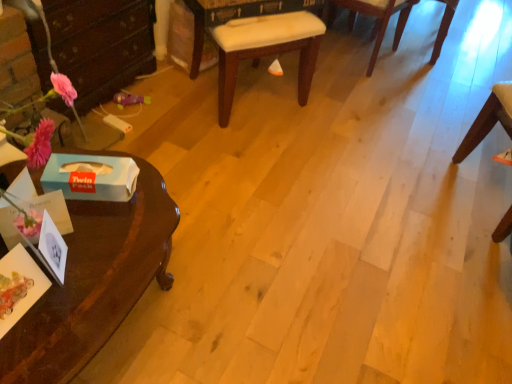
Question: Should I look upward or downward to see wooden chair at upper right, which ranks as the first chair in right-to-left order?

Choices:
 (A) up
 (B) down

Answer: (A)

Question: Is the position of white cardboard box at lower left, the 2th box when ordered from front to back, more distant than that of white fabric cushion at center, positioned as the first chair in left-to-right order?

Choices:
 (A) no
 (B) yes

Answer: (A)

Question: Is white cardboard box at lower left, the 2th box when ordered from front to back, turned away from white fabric cushion at center, positioned as the first chair in left-to-right order?

Choices:
 (A) no
 (B) yes

Answer: (A)

Question: Considering the relative sizes of white cardboard box at lower left, which ranks as the 1th box in back-to-front order, and white fabric cushion at center, which ranks as the 3th chair in right-to-left order, in the image provided, is white cardboard box at lower left, which ranks as the 1th box in back-to-front order, thinner than white fabric cushion at center, which ranks as the 3th chair in right-to-left order,?

Choices:
 (A) no
 (B) yes

Answer: (B)

Question: Is white cardboard box at lower left, which ranks as the 1th box in back-to-front order, positioned beyond the bounds of white fabric cushion at center, which ranks as the 3th chair in right-to-left order?

Choices:
 (A) no
 (B) yes

Answer: (B)

Question: Can you confirm if white cardboard box at lower left, which ranks as the 1th box in back-to-front order, is positioned to the left of white fabric cushion at center, which ranks as the 3th chair in right-to-left order?

Choices:
 (A) yes
 (B) no

Answer: (A)

Question: From the image's perspective, would you say white cardboard box at lower left, which ranks as the 1th box in back-to-front order, is shown under white fabric cushion at center, positioned as the first chair in left-to-right order?

Choices:
 (A) yes
 (B) no

Answer: (A)

Question: Is white cardboard box at lower left, the 2th box when ordered from front to back, positioned in front of wooden chair at right, arranged as the second chair when viewed from the left?

Choices:
 (A) yes
 (B) no

Answer: (A)

Question: From a real-world perspective, is white cardboard box at lower left, the 2th box when ordered from front to back, under wooden chair at right, arranged as the second chair when viewed from the left?

Choices:
 (A) no
 (B) yes

Answer: (A)

Question: Is the position of white cardboard box at lower left, which ranks as the 1th box in back-to-front order, more distant than that of wooden chair at right, acting as the second chair starting from the right?

Choices:
 (A) no
 (B) yes

Answer: (A)

Question: From a real-world perspective, is white cardboard box at lower left, the 2th box when ordered from front to back, located higher than wooden chair at right, acting as the second chair starting from the right?

Choices:
 (A) yes
 (B) no

Answer: (A)

Question: Does white cardboard box at lower left, which ranks as the 1th box in back-to-front order, have a larger size compared to wooden chair at right, acting as the second chair starting from the right?

Choices:
 (A) yes
 (B) no

Answer: (B)

Question: Does white cardboard box at lower left, the 2th box when ordered from front to back, have a greater width compared to wooden chair at right, arranged as the second chair when viewed from the left?

Choices:
 (A) yes
 (B) no

Answer: (B)

Question: Considering the relative sizes of wooden chair at right, arranged as the second chair when viewed from the left, and blue paper tissue box at left, the second box in the back-to-front sequence, in the image provided, is wooden chair at right, arranged as the second chair when viewed from the left, thinner than blue paper tissue box at left, the second box in the back-to-front sequence,?

Choices:
 (A) no
 (B) yes

Answer: (A)